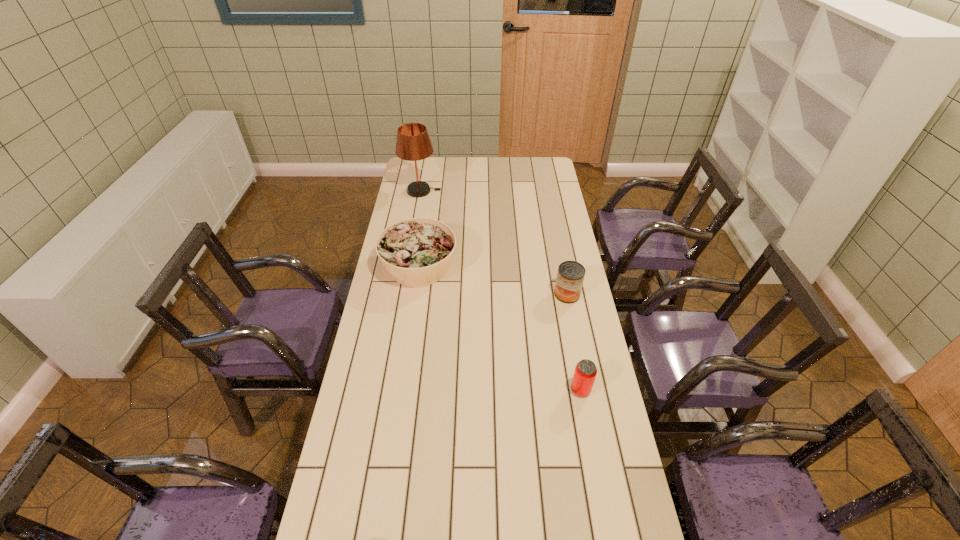
This screenshot has width=960, height=540. What are the coordinates of `the tallest object` in the screenshot? It's located at (413, 143).

Image resolution: width=960 pixels, height=540 pixels. I want to click on lampshade, so click(x=413, y=143).

I want to click on salad, so click(x=417, y=252).

Find the location of a particular element. The image size is (960, 540). the farther can is located at coordinates (570, 276).

Identify the location of the nearest object. (585, 372).

Where is `vacant space positioned on the front-facing side of the farthest object`? The height and width of the screenshot is (540, 960). vacant space positioned on the front-facing side of the farthest object is located at coordinates (459, 191).

The width and height of the screenshot is (960, 540). What are the coordinates of `free space located 0.390m on the front of the salad` in the screenshot? It's located at (402, 382).

This screenshot has height=540, width=960. Identify the location of free space located on the back of the farther can. (561, 260).

Where is `vacant region located 0.090m on the front of the nearest object`? vacant region located 0.090m on the front of the nearest object is located at coordinates (588, 426).

Find the location of a particular element. This screenshot has height=540, width=960. lampshade that is at the left edge is located at coordinates (413, 143).